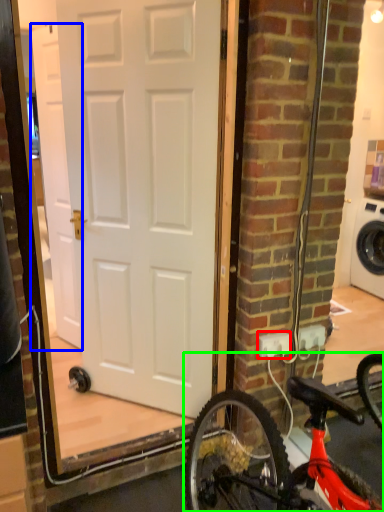
Question: Which object is positioned farthest from electric outlet (highlighted by a red box)? Select from door (highlighted by a blue box) and bicycle (highlighted by a green box).

Choices:
 (A) door
 (B) bicycle

Answer: (A)